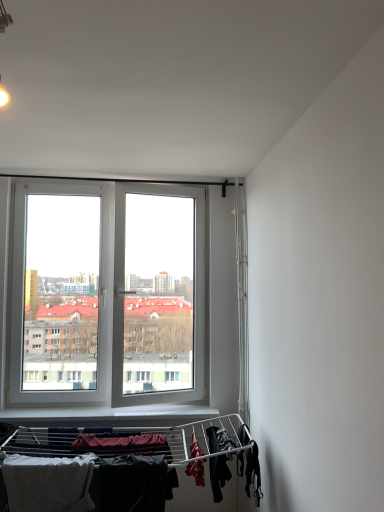
Question: Can you confirm if dark matte fabric at lower center, the 2th clothing when ordered from right to left, is taller than black fabric at lower right, which ranks as the 1th clothing in right-to-left order?

Choices:
 (A) no
 (B) yes

Answer: (B)

Question: Is black fabric at lower right, placed as the third clothing when sorted from left to right, at the back of dark matte fabric at lower center, the 2th clothing when ordered from right to left?

Choices:
 (A) yes
 (B) no

Answer: (B)

Question: Is dark matte fabric at lower center, which is the 2th clothing from left to right, far from black fabric at lower right, which ranks as the 1th clothing in right-to-left order?

Choices:
 (A) no
 (B) yes

Answer: (A)

Question: Does dark matte fabric at lower center, the 2th clothing when ordered from right to left, appear on the left side of black fabric at lower right, which ranks as the 1th clothing in right-to-left order?

Choices:
 (A) yes
 (B) no

Answer: (A)

Question: Is dark matte fabric at lower center, which is the 2th clothing from left to right, at the right side of black fabric at lower right, placed as the third clothing when sorted from left to right?

Choices:
 (A) yes
 (B) no

Answer: (B)

Question: From the image's perspective, is dark matte fabric at lower center, which is the 2th clothing from left to right, under black fabric at lower right, placed as the third clothing when sorted from left to right?

Choices:
 (A) no
 (B) yes

Answer: (B)

Question: Is the position of gray cotton towel at lower left, the 3th clothing from the right, more distant than that of dark matte fabric at lower center, which is the 2th clothing from left to right?

Choices:
 (A) yes
 (B) no

Answer: (B)

Question: From the image's perspective, is gray cotton towel at lower left, arranged as the first clothing when viewed from the left, below dark matte fabric at lower center, which is the 2th clothing from left to right?

Choices:
 (A) no
 (B) yes

Answer: (B)

Question: Would you say gray cotton towel at lower left, the 3th clothing from the right, is outside dark matte fabric at lower center, the 2th clothing when ordered from right to left?

Choices:
 (A) no
 (B) yes

Answer: (B)

Question: Does gray cotton towel at lower left, the 3th clothing from the right, contain dark matte fabric at lower center, the 2th clothing when ordered from right to left?

Choices:
 (A) no
 (B) yes

Answer: (A)

Question: From a real-world perspective, is gray cotton towel at lower left, arranged as the first clothing when viewed from the left, on top of dark matte fabric at lower center, which is the 2th clothing from left to right?

Choices:
 (A) yes
 (B) no

Answer: (B)

Question: Is gray cotton towel at lower left, the 3th clothing from the right, touching dark matte fabric at lower center, the 2th clothing when ordered from right to left?

Choices:
 (A) yes
 (B) no

Answer: (B)

Question: From a real-world perspective, does black fabric at lower right, which ranks as the 1th clothing in right-to-left order, sit lower than gray cotton towel at lower left, the 3th clothing from the right?

Choices:
 (A) yes
 (B) no

Answer: (B)